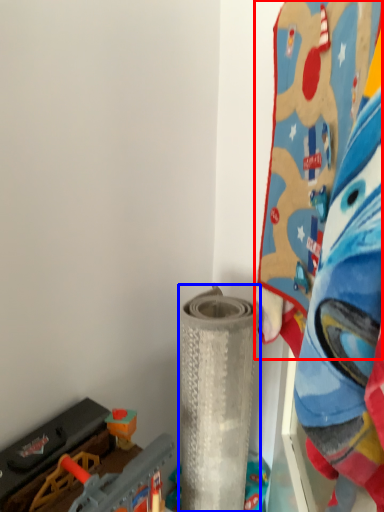
Question: Among these objects, which one is farthest to the camera, toy (highlighted by a red box) or toy (highlighted by a blue box)?

Choices:
 (A) toy
 (B) toy

Answer: (B)